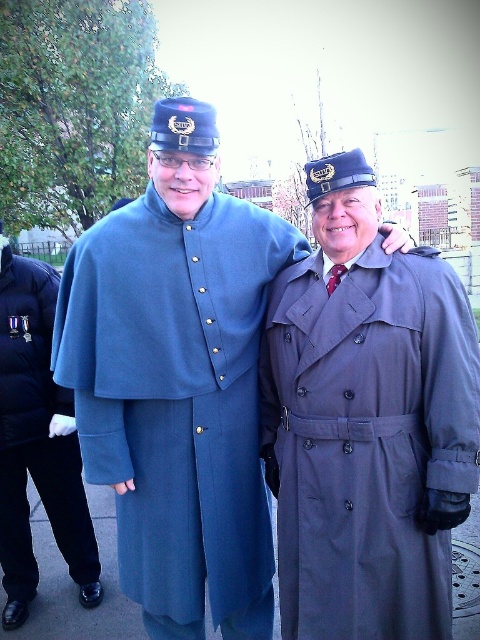
Is gray matte trench coat at right behind blue wool cape at center?

No, it is in front of blue wool cape at center.

Which is in front, point (411, 424) or point (12, 449)?

Point (411, 424) is in front.

At what (x,y) coordinates should I click in order to perform the action: click on gray matte trench coat at right. Please return your answer as a coordinate pair (x, y). Looking at the image, I should click on (367, 422).

Locate an element on the screen. The image size is (480, 640). gray matte trench coat at right is located at coordinates (367, 422).